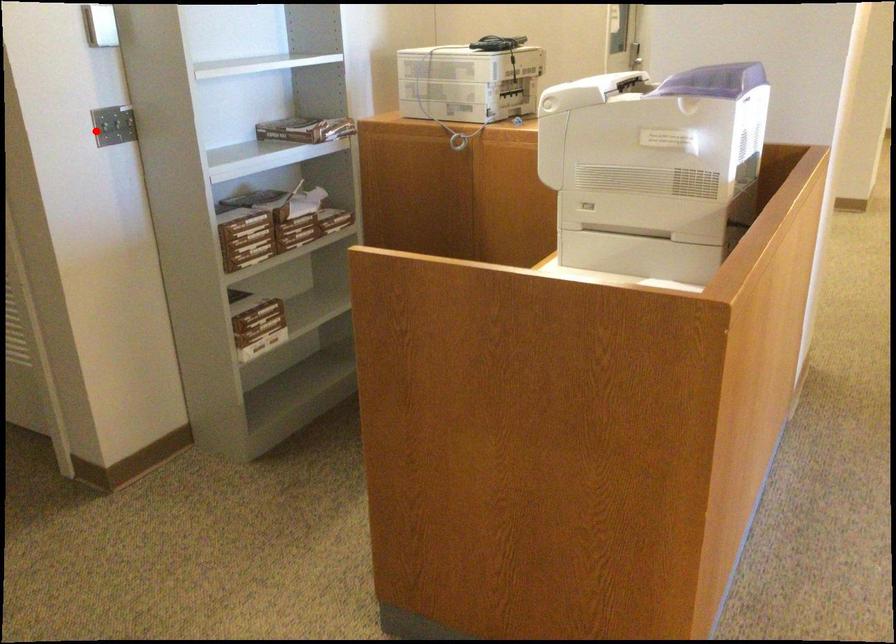
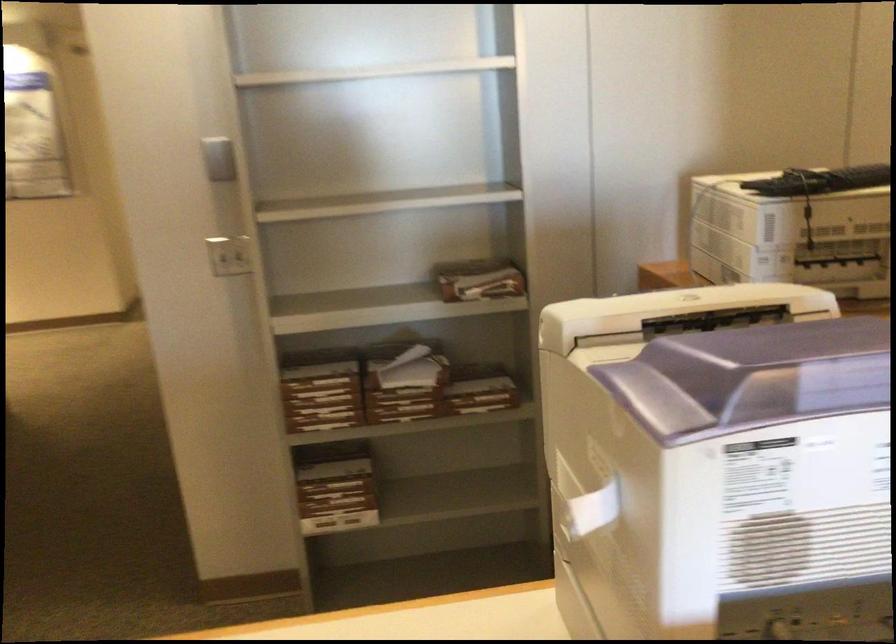
The point at the highlighted location is marked in the first image. Where is the corresponding point in the second image?

(228, 254)